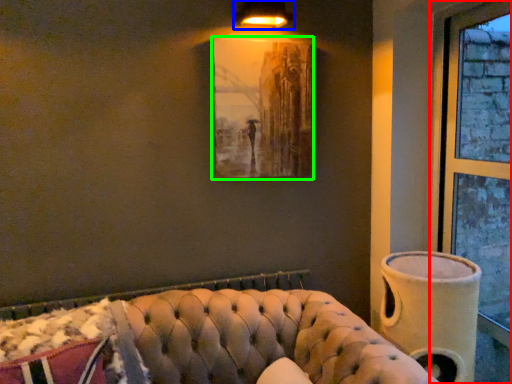
Question: Considering the real-world distances, which object is closest to window (highlighted by a red box)? lamp (highlighted by a blue box) or picture frame (highlighted by a green box).

Choices:
 (A) lamp
 (B) picture frame

Answer: (B)